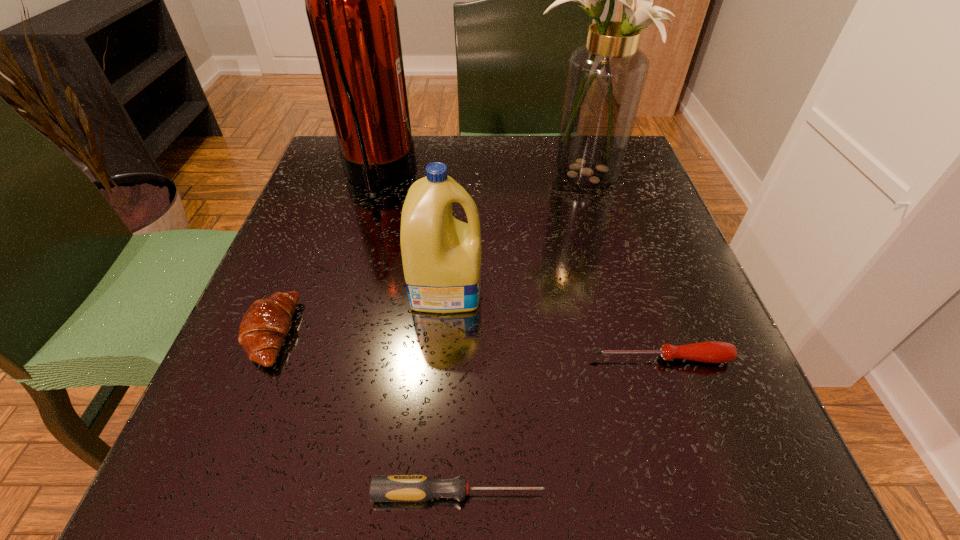
You are a GUI agent. You are given a task and a screenshot of the screen. Output one action in this format:
    pyautogui.click(x=<x>, y=<y>)
    Task: Click on the vacant space situated on the right of the crescent roll
    This screenshot has height=540, width=960.
    Given the screenshot: What is the action you would take?
    pyautogui.click(x=352, y=333)

I want to click on free space located 0.300m on the left of the right screwdriver, so click(386, 359).

The width and height of the screenshot is (960, 540). In order to click on vacant space located insert the left screwdriver into a screw head in this screenshot , I will do `click(629, 493)`.

Find the location of `fire extinguisher located at the far edge`. fire extinguisher located at the far edge is located at coordinates (350, 0).

Where is `flower arrangement located in the far edge section of the desktop`? The width and height of the screenshot is (960, 540). flower arrangement located in the far edge section of the desktop is located at coordinates (605, 79).

Where is `object located at the near edge`? This screenshot has width=960, height=540. object located at the near edge is located at coordinates (383, 488).

This screenshot has width=960, height=540. I want to click on fire extinguisher that is at the left edge, so coord(350,0).

Identify the location of crescent roll present at the left edge. The image size is (960, 540). (266, 323).

Locate an element on the screen. The height and width of the screenshot is (540, 960). flower arrangement at the right edge is located at coordinates (605, 79).

You are a GUI agent. You are given a task and a screenshot of the screen. Output one action in this format:
    pyautogui.click(x=<x>, y=<y>)
    Task: Click on the screwdriver that is at the right edge
    
    Given the screenshot: What is the action you would take?
    pyautogui.click(x=708, y=351)